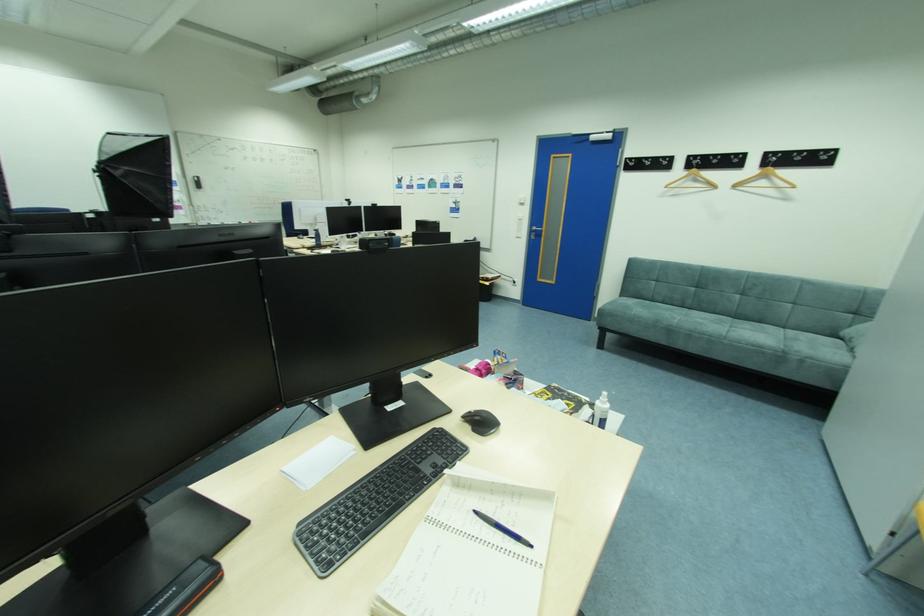
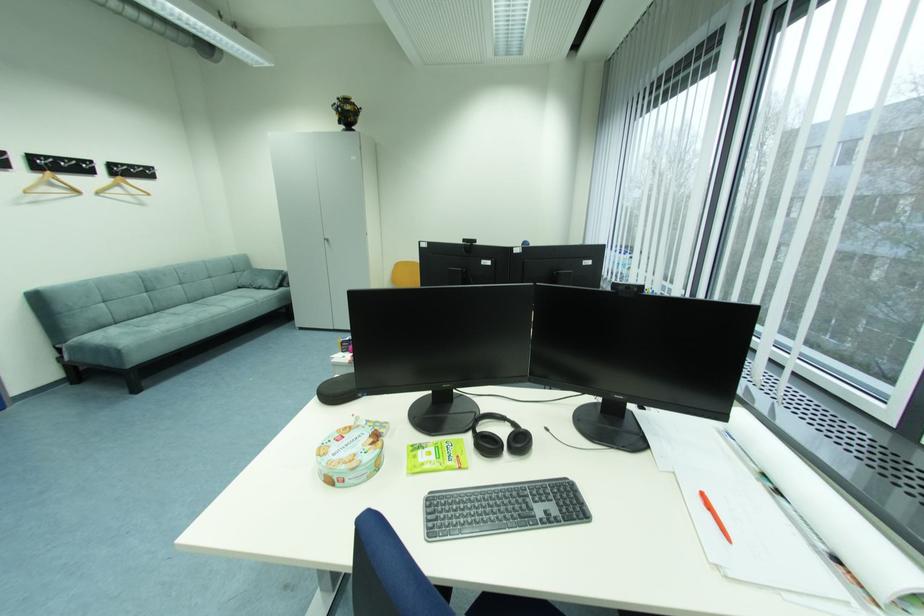
In the second image, find the point that corresponds to pixel 702 182 in the first image.

(59, 185)